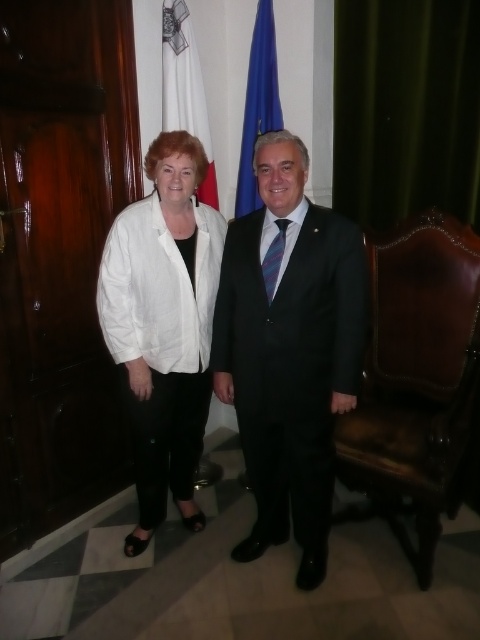
Is point (400, 428) positioned behind point (146, 323)?

Yes, point (400, 428) is behind point (146, 323).

How much distance is there between brown leather armchair at right and white cotton blouse at center?

brown leather armchair at right and white cotton blouse at center are 28.92 inches apart.

Locate an element on the screen. This screenshot has width=480, height=640. brown leather armchair at right is located at coordinates (416, 380).

Can you confirm if brown leather armchair at right is smaller than blue fabric flag at upper center?

No, brown leather armchair at right is not smaller than blue fabric flag at upper center.

Where is `brown leather armchair at right`? The width and height of the screenshot is (480, 640). brown leather armchair at right is located at coordinates (416, 380).

This screenshot has width=480, height=640. Find the location of `brown leather armchair at right`. brown leather armchair at right is located at coordinates (416, 380).

Can you confirm if brown leather armchair at right is positioned to the right of white fabric flag at upper left?

Indeed, brown leather armchair at right is positioned on the right side of white fabric flag at upper left.

Is brown leather armchair at right further to camera compared to white fabric flag at upper left?

No.

Describe the element at coordinates (416, 380) in the screenshot. I see `brown leather armchair at right` at that location.

Where is `brown leather armchair at right`? brown leather armchair at right is located at coordinates pyautogui.click(x=416, y=380).